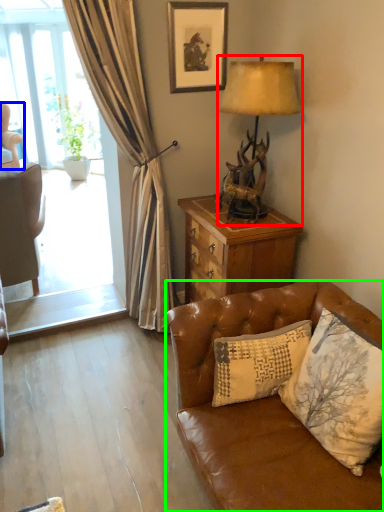
Question: Which object is the closest to the lamp (highlighted by a red box)? Choose among these: chair (highlighted by a blue box) or studio couch (highlighted by a green box).

Choices:
 (A) chair
 (B) studio couch

Answer: (B)